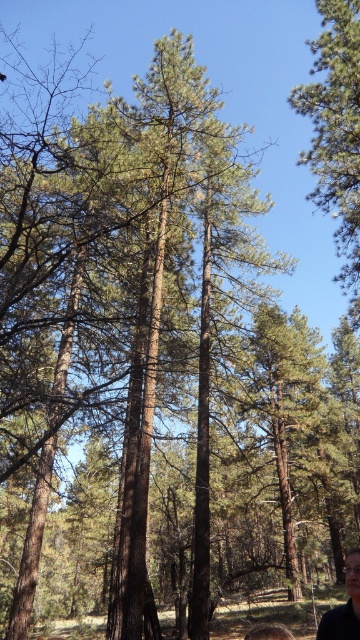
You are standing in the forest and see the point marked at coordinates (344,605). What is located at that point?

The dark brown hair at lower right is located at point (344,605).

You are standing in the center of the forest looking towards the lower right corner where you see a dark brown hair. If the forest floor is 10 meters wide from left to right, can you estimate how far the dark brown hair at lower right is from the left edge of the forest floor?

The dark brown hair at lower right is located at point 0.947 on the x coordinate, so it is approximately 9.47 meters from the left edge of the forest floor.